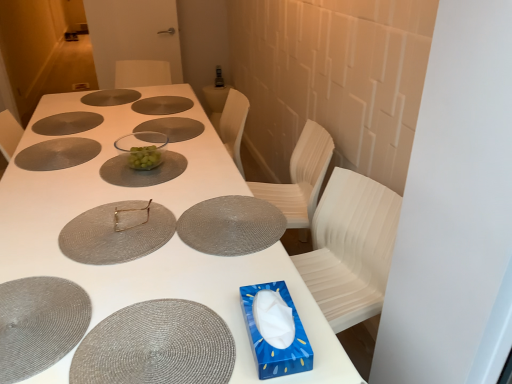
Identify the location of free area in between matte gray glass plate at upper left, the fifth glass plate when ordered from front to back, and transparent glass bowl at center, acting as the sixth glass plate starting from the back. This screenshot has width=512, height=384. (97, 155).